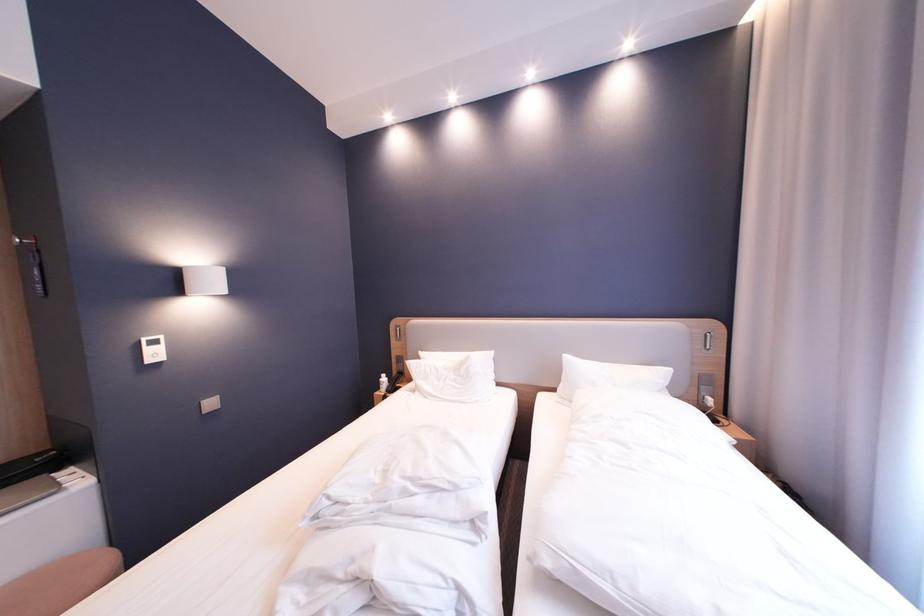
Find where to push the silver light switch. Please return your answer as a coordinate pair (x, y).

(210, 405)